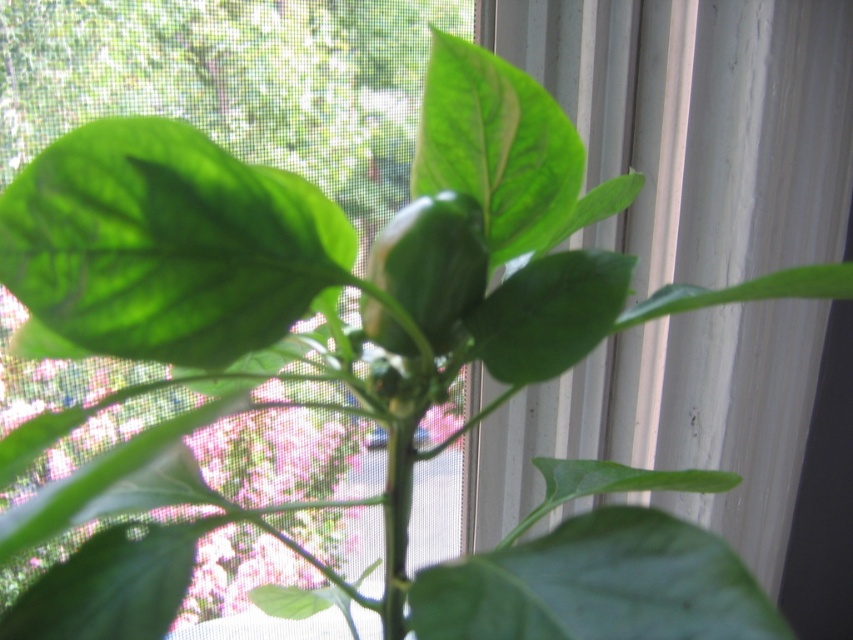
You are a GUI agent. You are given a task and a screenshot of the screen. Output one action in this format:
    pyautogui.click(x=<x>, y=<y>)
    Task: Click on the green matte leaf at upper left
    The width and height of the screenshot is (853, 640).
    Given the screenshot: What is the action you would take?
    pyautogui.click(x=166, y=243)

Describe the element at coordinates (166, 243) in the screenshot. I see `green matte leaf at upper left` at that location.

Identify the location of green matte leaf at upper left. The image size is (853, 640). (166, 243).

Which of these two, green matte leaf at upper left or green matte leaf at center, stands taller?

With more height is green matte leaf at upper left.

Is point (267, 198) in front of point (480, 308)?

Yes, point (267, 198) is closer to viewer.

I want to click on green matte leaf at upper left, so click(x=166, y=243).

Does green smooth leaf at center appear on the left side of green matte leaf at center?

Yes, green smooth leaf at center is to the left of green matte leaf at center.

Does point (697, 618) come in front of point (576, 282)?

Yes, point (697, 618) is in front of point (576, 282).

Which is in front, point (757, 593) or point (602, 276)?

Positioned in front is point (757, 593).

At what (x,y) coordinates should I click in order to perform the action: click on green smooth leaf at center. Please return your answer as a coordinate pair (x, y). Looking at the image, I should click on (598, 586).